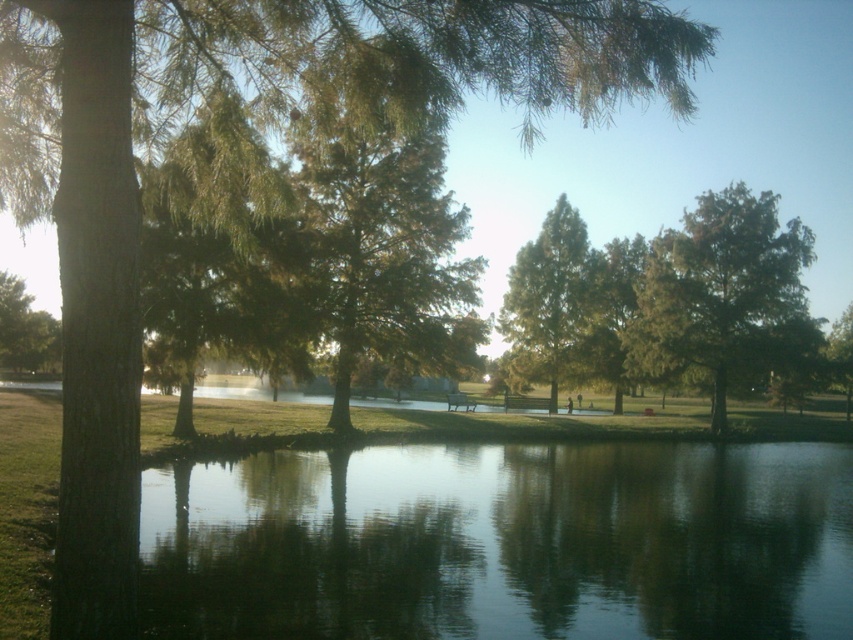
Describe the element at coordinates (503, 541) in the screenshot. I see `green reflective water at center` at that location.

Does green reflective water at center have a lesser width compared to green matte tree at center?

No, green reflective water at center is not thinner than green matte tree at center.

Who is more forward, (184,465) or (589,323)?

Point (184,465) is more forward.

Locate an element on the screen. green reflective water at center is located at coordinates (503, 541).

Can you confirm if green matte tree at center is thinner than green leafy tree at left?

Yes.

Which is more to the left, green matte tree at center or green leafy tree at left?

green leafy tree at left

Measure the distance between green matte tree at center and camera.

They are 63.34 meters apart.

Locate an element on the screen. green matte tree at center is located at coordinates (552, 300).

Is point (737, 323) behind point (577, 262)?

No, it is not.

Who is more forward, (718, 394) or (532, 333)?

Point (718, 394) is in front.

Which is in front, point (654, 362) or point (509, 275)?

Positioned in front is point (654, 362).

Locate an element on the screen. green leafy tree at upper right is located at coordinates (723, 296).